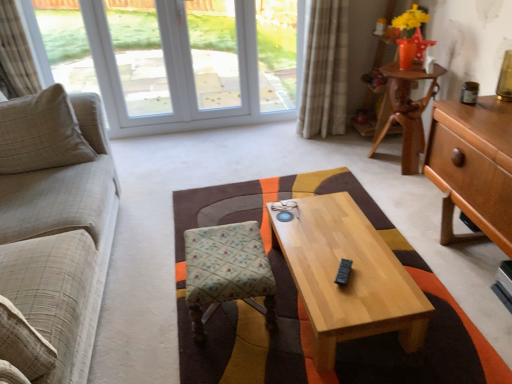
Where is `blank space to the left of patterned fabric stool at center`? The width and height of the screenshot is (512, 384). blank space to the left of patterned fabric stool at center is located at coordinates (143, 307).